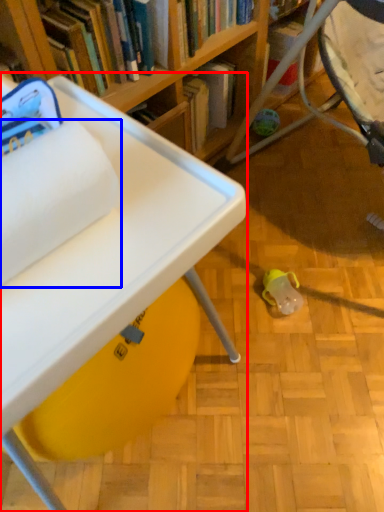
Question: Which object appears farthest to the camera in this image, table (highlighted by a red box) or toilet paper (highlighted by a blue box)?

Choices:
 (A) table
 (B) toilet paper

Answer: (A)